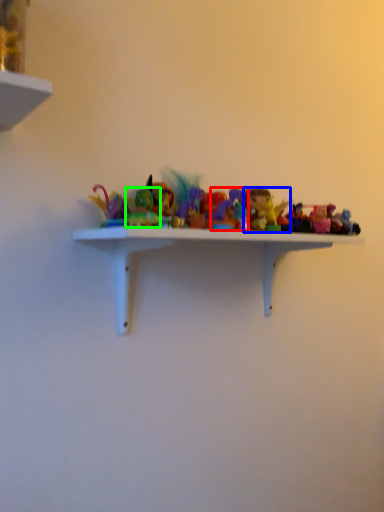
Question: Which object is the closest to the toy (highlighted by a red box)? Choose among these: toy (highlighted by a blue box) or toy (highlighted by a green box).

Choices:
 (A) toy
 (B) toy

Answer: (A)